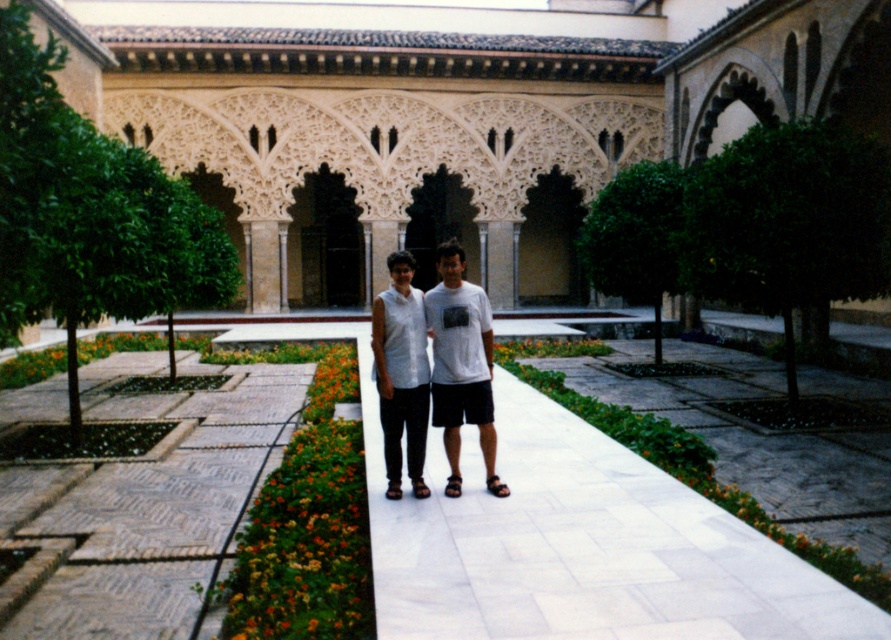
Question: Which of the following is the farthest from the observer?

Choices:
 (A) [x=781, y=602]
 (B) [x=491, y=465]

Answer: (B)

Question: Which of the following is the farthest from the observer?

Choices:
 (A) white stone arches at center
 (B) white stone path at center
 (C) white cotton shirt at center
 (D) white matte shirt at center

Answer: (A)

Question: Which of these objects is positioned farthest from the white cotton shirt at center?

Choices:
 (A) white matte shirt at center
 (B) white stone arches at center
 (C) white stone path at center

Answer: (B)

Question: Does white stone arches at center lie behind white cotton shirt at center?

Choices:
 (A) yes
 (B) no

Answer: (A)

Question: Is white stone arches at center below white cotton shirt at center?

Choices:
 (A) yes
 (B) no

Answer: (B)

Question: Is white stone arches at center to the left of white stone path at center from the viewer's perspective?

Choices:
 (A) no
 (B) yes

Answer: (B)